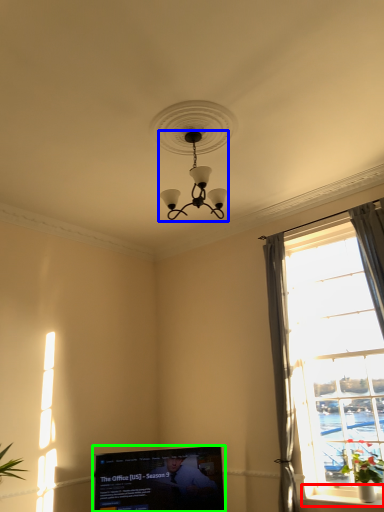
Question: Estimate the real-world distances between objects in this image. Which object is closer to window sill (highlighted by a red box), lamp (highlighted by a blue box) or television (highlighted by a green box)?

Choices:
 (A) lamp
 (B) television

Answer: (B)